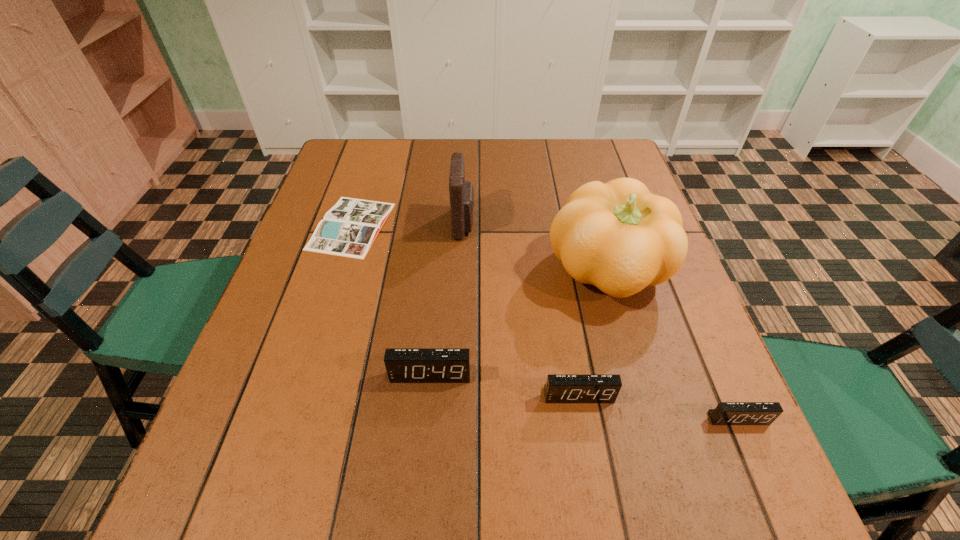
Identify the location of free spot located on the front-facing side of the tallest alarm clock. The height and width of the screenshot is (540, 960). (426, 424).

Locate an element on the screen. This screenshot has width=960, height=540. vacant position located with an open flap on the pouch is located at coordinates (587, 224).

In order to click on free region located on the front of the pumpkin in this screenshot , I will do `click(655, 435)`.

Identify the location of free spot located on the back of the leftmost object. The image size is (960, 540). (377, 144).

Identify the location of object at the left edge. (349, 228).

In order to click on alarm clock at the right edge in this screenshot , I will do `click(726, 413)`.

At what (x,y) coordinates should I click in order to perform the action: click on pumpkin that is positioned at the right edge. Please return your answer as a coordinate pair (x, y). This screenshot has width=960, height=540. Looking at the image, I should click on (618, 236).

Identify the location of object positioned at the near right corner. (726, 413).

Find the location of a particular element. The height and width of the screenshot is (540, 960). vacant space at the far edge of the desktop is located at coordinates (566, 180).

This screenshot has width=960, height=540. I want to click on free space at the near edge of the desktop, so click(560, 415).